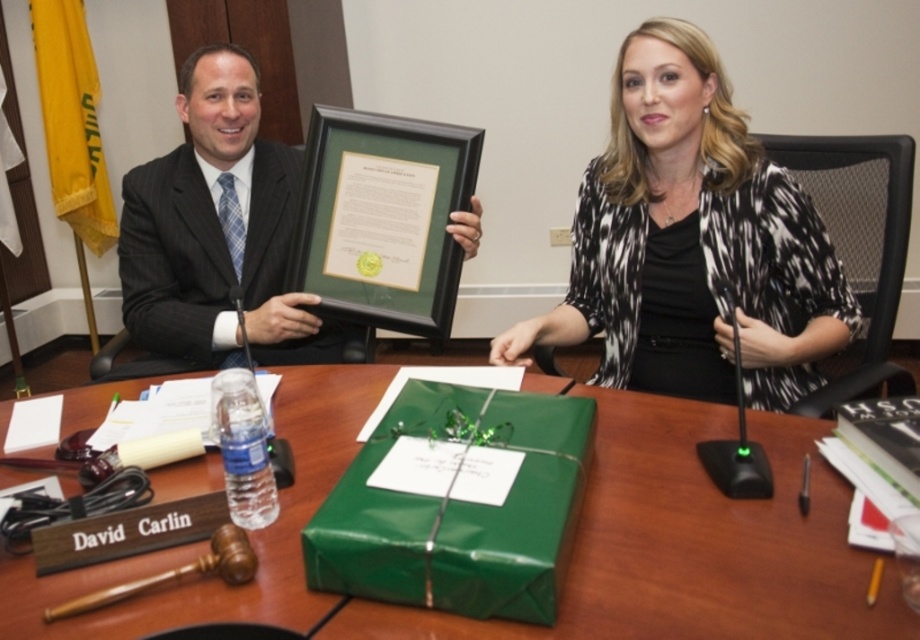
You are a fashion designer observing a professional meeting. You need to determine which clothing item has a greater width between the black and white printed blouse at center and the dark gray pinstripe suit at left. Which one is wider?

The black and white printed blouse at center is wider than the dark gray pinstripe suit at left according to the description.

You are a delivery person who needs to place a 12 inch long package on the table between the green paper wrapped gift at center and the David Carlin nameplate. Can you fit it there?

The distance between the green paper wrapped gift at center and the David Carlin nameplate is 30.88 inches. Since the package is 12 inches long, there is enough space to fit it between them.

You are standing in front of the conference table and want to place a 4 feet long object on the table. The table has a point at coordinates point (608, 419). Can you determine if the 4 feet long object will fit on the table?

The distance of point (608, 419) from camera is 4.16 feet. Since the object is 4 feet long, it will fit on the table as the distance from the camera to the point is sufficient.